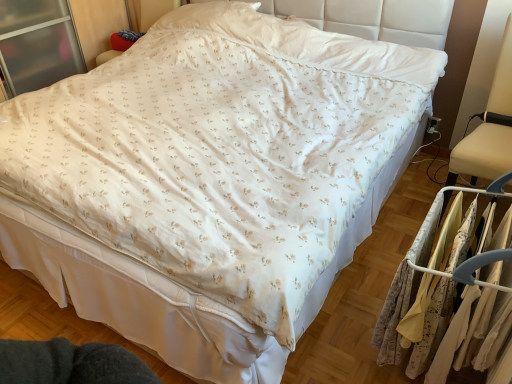
Question: Choose the correct answer: Is silky beige fabric at right inside beige fabric swivel chair at right or outside it?

Choices:
 (A) outside
 (B) inside

Answer: (A)

Question: Is point (467, 213) closer or farther from the camera than point (483, 148)?

Choices:
 (A) closer
 (B) farther

Answer: (A)

Question: Based on their relative distances, which object is nearer to the silky beige fabric at right?

Choices:
 (A) beige fabric swivel chair at right
 (B) floral fabric dress at right

Answer: (B)

Question: Which is nearer to the beige fabric swivel chair at right?

Choices:
 (A) floral fabric dress at right
 (B) silky beige fabric at right

Answer: (B)